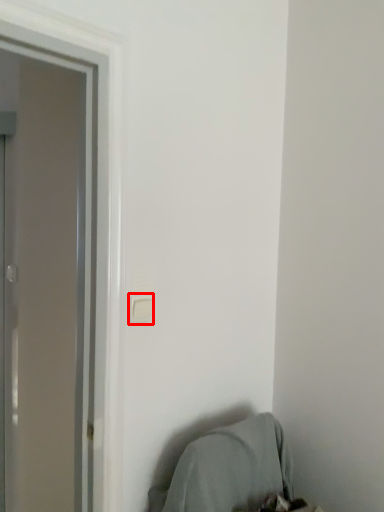
Question: Considering the relative positions of light switch (annotated by the red box) and bean bag chair in the image provided, where is light switch (annotated by the red box) located with respect to the staircase?

Choices:
 (A) left
 (B) right

Answer: (A)